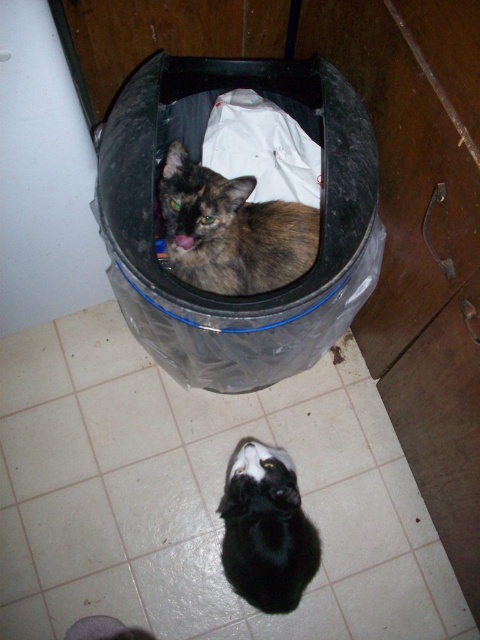
You are a cat owner who wants to ensure your cat can comfortably fit inside a new trash can. You see the black glossy cat at lower center and the white fabric at center in the image. Which object is larger in size?

The black glossy cat at lower center is bigger than the white fabric at center, so the cat is larger in size.

You are a pet owner who just noticed your cat is inside the trash can. You see the brown fur cat at center and the white fabric at center. Which object is on top of the other?

The brown fur cat at center is positioned under white fabric at center, so the white fabric at center is on top of the brown fur cat at center.